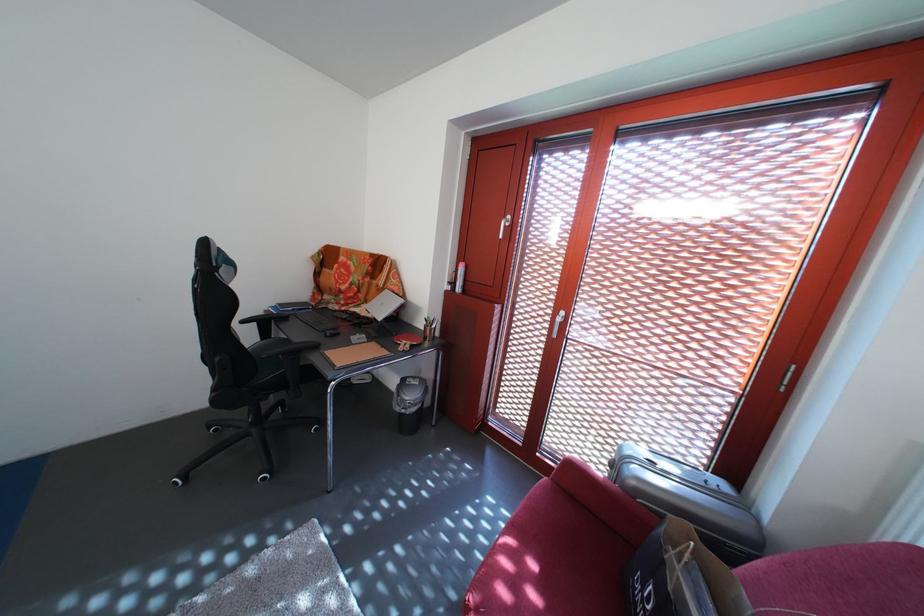
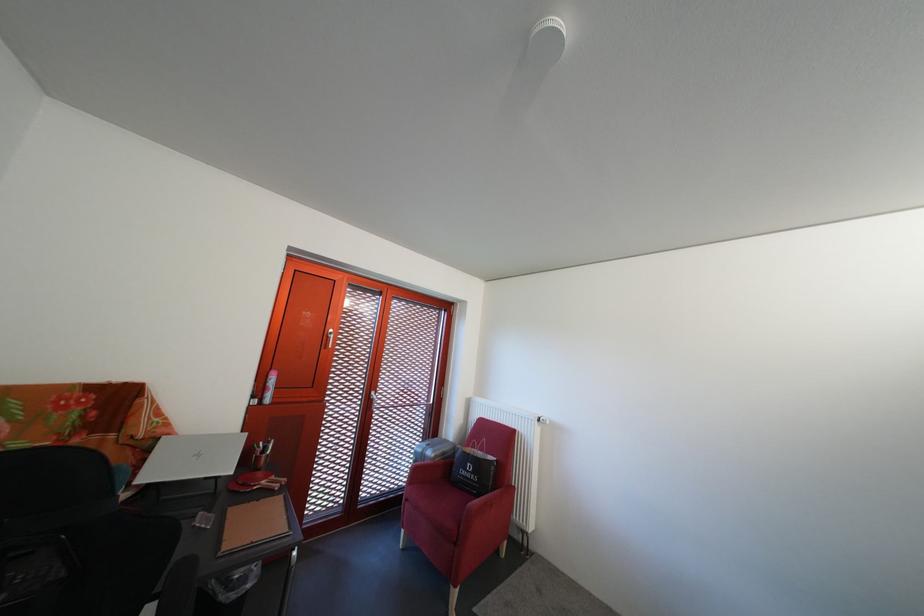
The point at (460,290) is marked in the first image. Where is the corresponding point in the second image?

(263, 403)